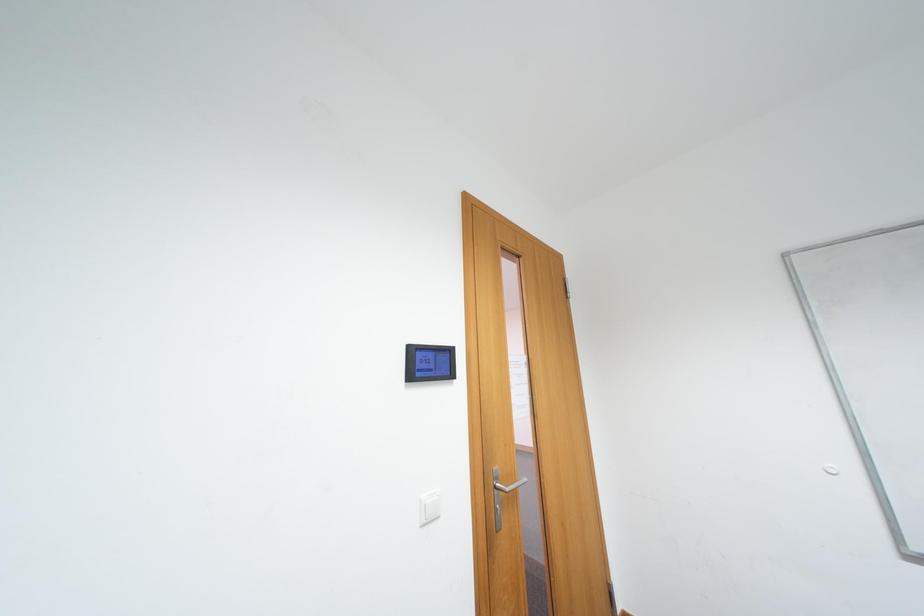
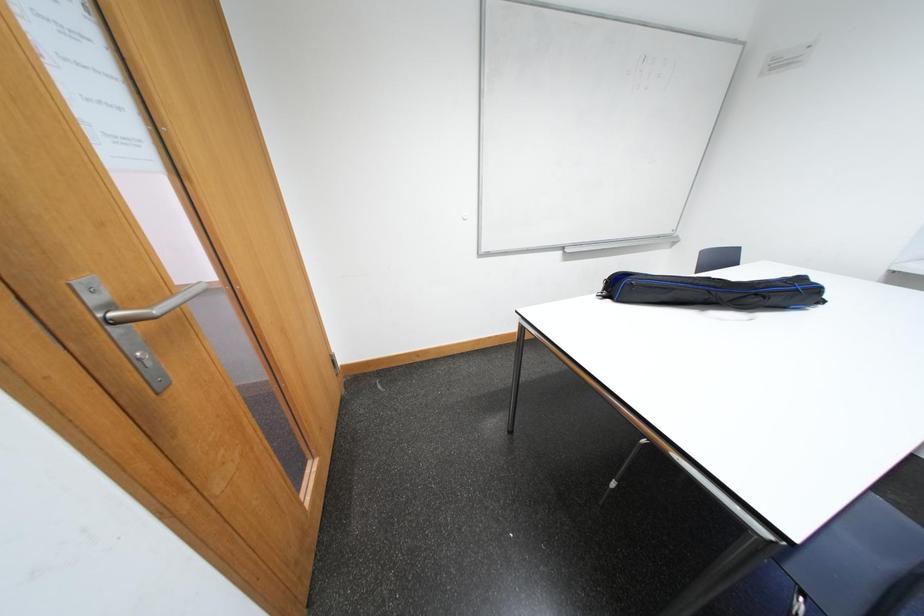
How did the camera likely rotate?

The rotation direction of the camera is right-down.